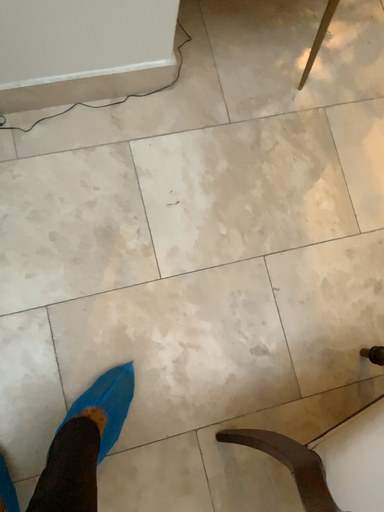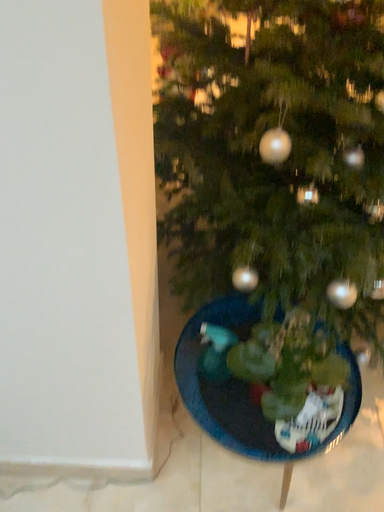
Question: How did the camera likely rotate when shooting the video?

Choices:
 (A) rotated downward
 (B) rotated upward

Answer: (B)